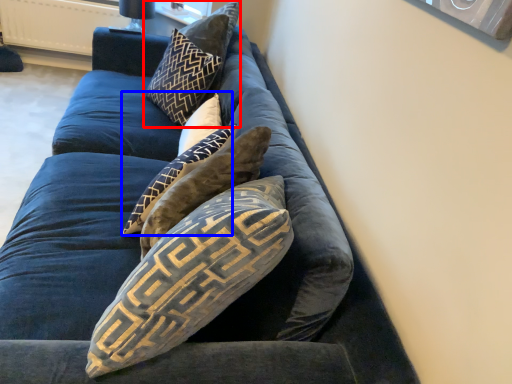
Question: Which of the following is the closest to the observer, pillow (highlighted by a red box) or pillow (highlighted by a blue box)?

Choices:
 (A) pillow
 (B) pillow

Answer: (B)